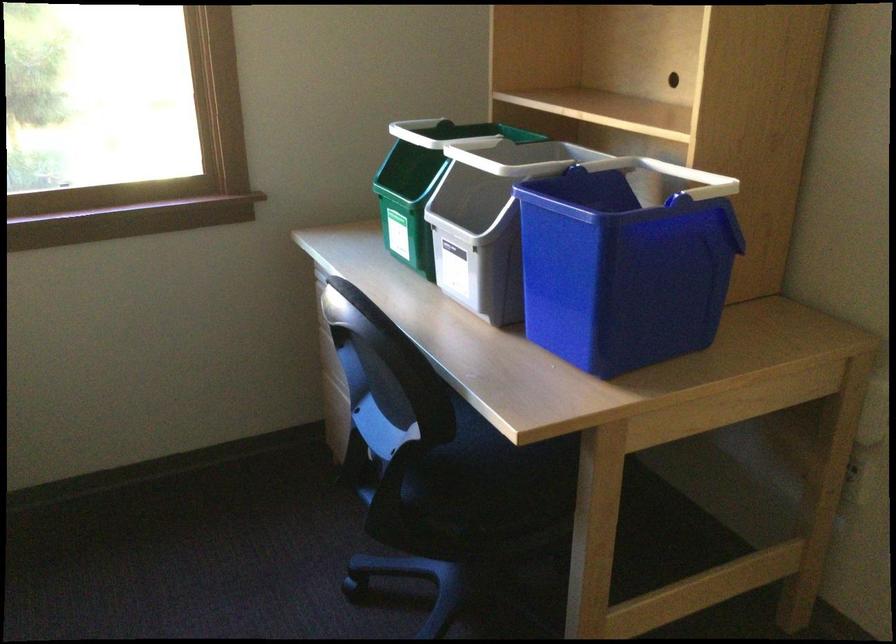
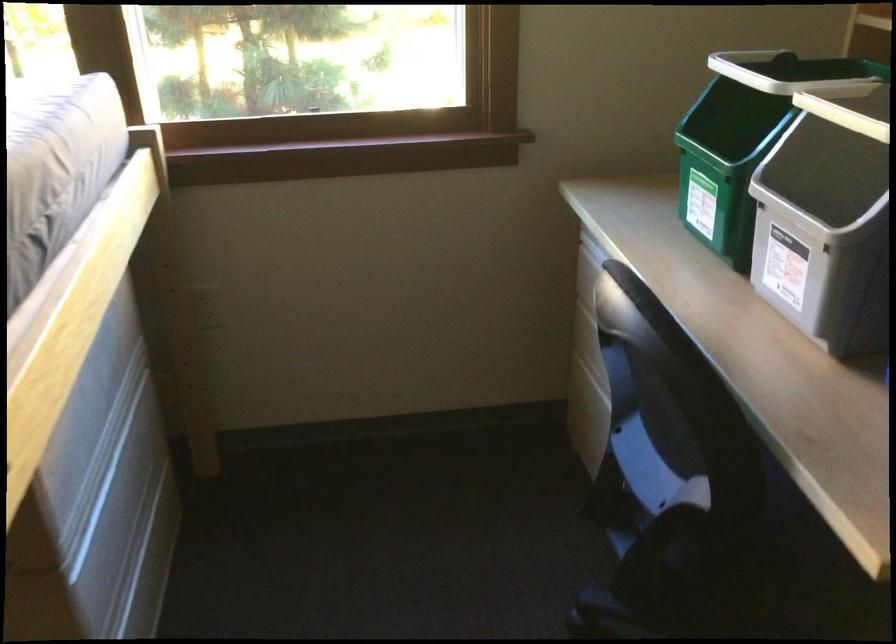
Question: The camera is either moving clockwise (left) or counter-clockwise (right) around the object. The first image is from the beginning of the video and the second image is from the end. Is the camera moving left or right when shooting the video?

Choices:
 (A) Left
 (B) Right

Answer: (B)